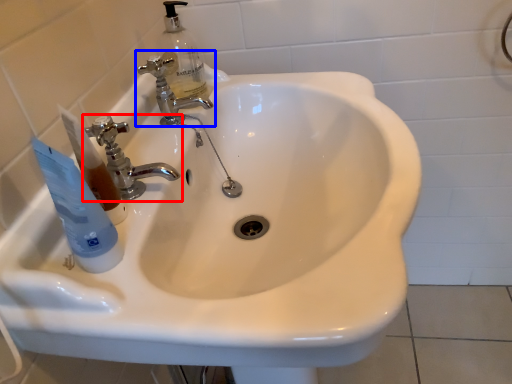
Question: Which of the following is the farthest to the observer, tap (highlighted by a red box) or tap (highlighted by a blue box)?

Choices:
 (A) tap
 (B) tap

Answer: (B)